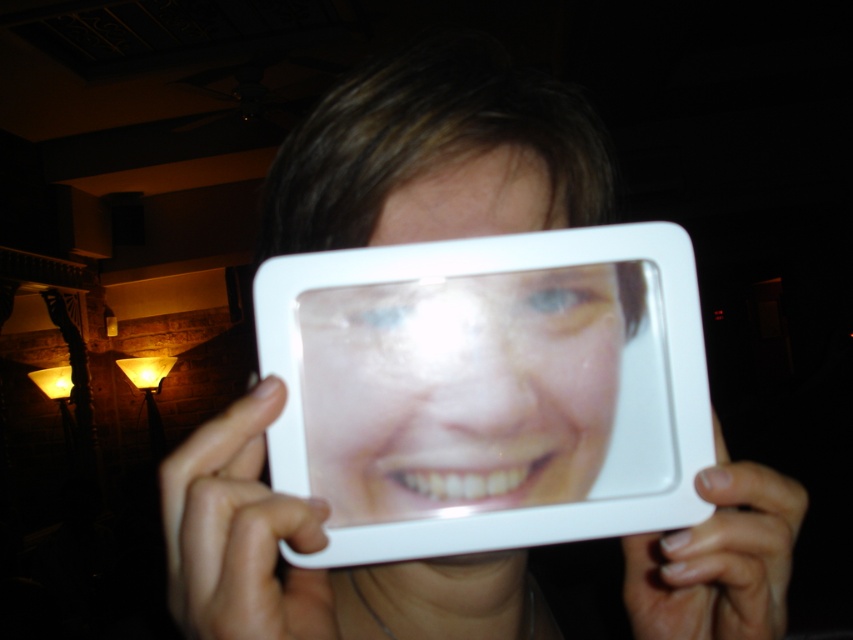
You are standing in a room with stone walls and warm lighting. You see two points marked in the scene. The first point is at coordinates point (160, 468) and the second is at point (776, 557). Which point is closer to you?

A: Point (160, 468) is closer to the viewer than point (776, 557).

You have a white matte phone at center and a white matte plastic at lower right in your hand. Which object is wider?

The white matte phone at center is wider than the white matte plastic at lower right.

You are trying to take a selfie with your phone while holding a mirror in front of your face. You have a matte plastic face at center and a white matte phone at center. Which object is closer to you, the photographer?

The matte plastic face at center is closer to you, the photographer, because the white matte phone at center is behind it.